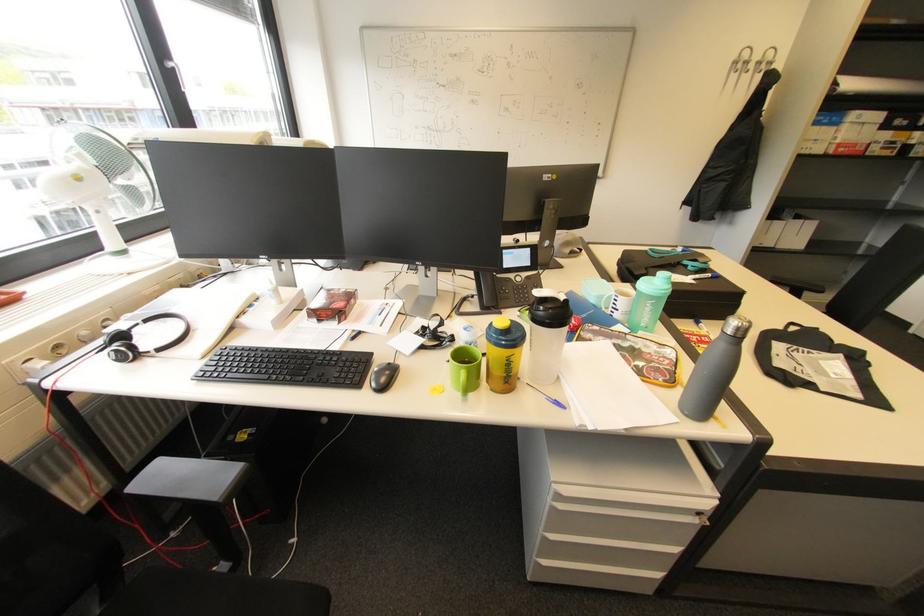
Where is `green mug handle`? The image size is (924, 616). green mug handle is located at coordinates (465, 369).